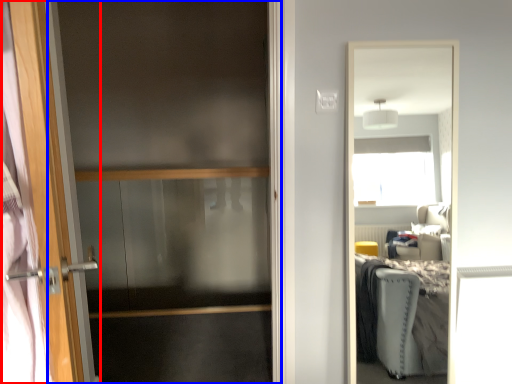
Question: Which object is closer to the camera taking this photo, door (highlighted by a red box) or screen door (highlighted by a blue box)?

Choices:
 (A) door
 (B) screen door

Answer: (A)